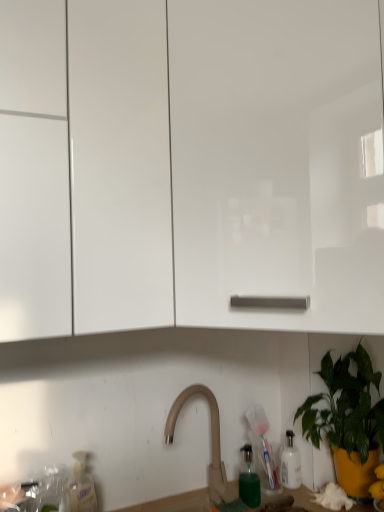
Question: Considering the positions of point (226, 242) and point (367, 419), is point (226, 242) closer or farther from the camera than point (367, 419)?

Choices:
 (A) closer
 (B) farther

Answer: (A)

Question: From a real-world perspective, relative to green glossy plant at lower right, is white matte cabinet at center, which ranks as the 1th cabinetry in right-to-left order, vertically above or below?

Choices:
 (A) above
 (B) below

Answer: (A)

Question: Which object is positioned farthest from the white matte cabinet at center, which is counted as the 2th cabinetry, starting from the left?

Choices:
 (A) transparent plastic bottle at lower left
 (B) white glossy cabinet at upper left, the first cabinetry from the left
 (C) beige matte faucet at center
 (D) green glossy plant at lower right

Answer: (A)

Question: Which object is positioned closest to the white matte cabinet at center, which is counted as the 2th cabinetry, starting from the left?

Choices:
 (A) white glossy cabinet at upper left, the first cabinetry from the left
 (B) beige matte faucet at center
 (C) transparent plastic bottle at lower left
 (D) green glossy plant at lower right

Answer: (A)